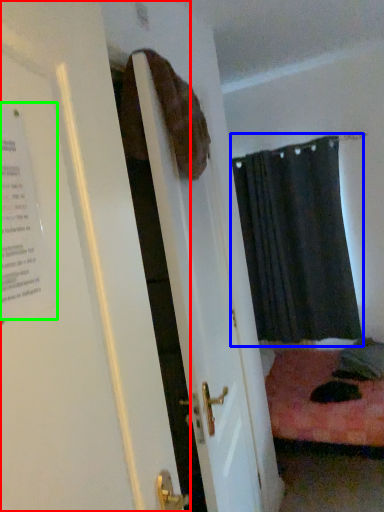
Question: Estimate the real-world distances between objects in this image. Which object is farther from door (highlighted by a red box), curtain (highlighted by a blue box) or poster (highlighted by a green box)?

Choices:
 (A) curtain
 (B) poster

Answer: (A)